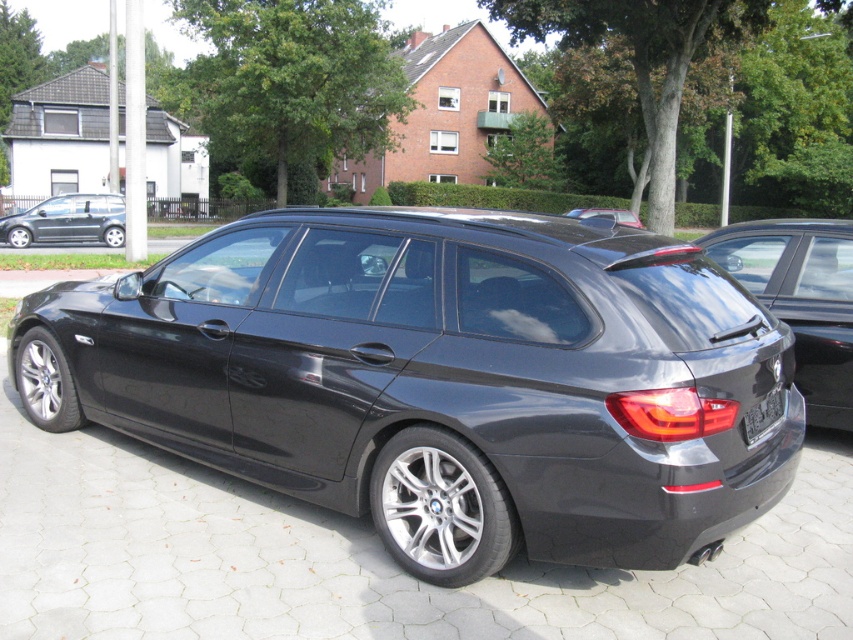
Question: Is satin black wagon at center to the left of satin black car at center from the viewer's perspective?

Choices:
 (A) no
 (B) yes

Answer: (B)

Question: Is glossy black car at right positioned at the back of black plastic license plate at rear?

Choices:
 (A) yes
 (B) no

Answer: (A)

Question: Which point is closer to the camera?

Choices:
 (A) matte gray hatchback at left
 (B) satin black wagon at center
 (C) glossy black car at right
 (D) satin black car at center

Answer: (B)

Question: Can you confirm if satin black wagon at center is smaller than black plastic license plate at rear?

Choices:
 (A) no
 (B) yes

Answer: (A)

Question: Which object is positioned closest to the satin black wagon at center?

Choices:
 (A) satin black car at center
 (B) matte gray hatchback at left
 (C) black plastic license plate at rear
 (D) glossy black car at right

Answer: (C)

Question: Which point appears farthest from the camera in this image?

Choices:
 (A) (619, 211)
 (B) (757, 403)
 (C) (97, 227)

Answer: (A)